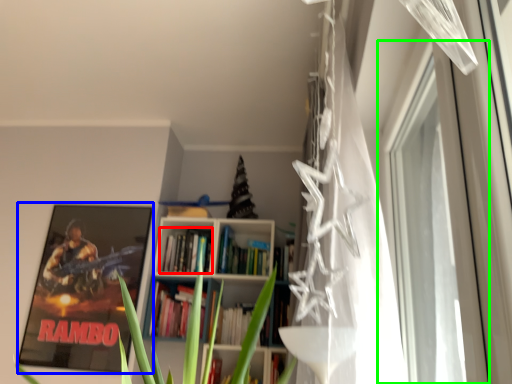
Question: Which object is positioned closest to book (highlighted by a red box)? Select from picture frame (highlighted by a blue box) and window (highlighted by a green box).

Choices:
 (A) picture frame
 (B) window

Answer: (A)